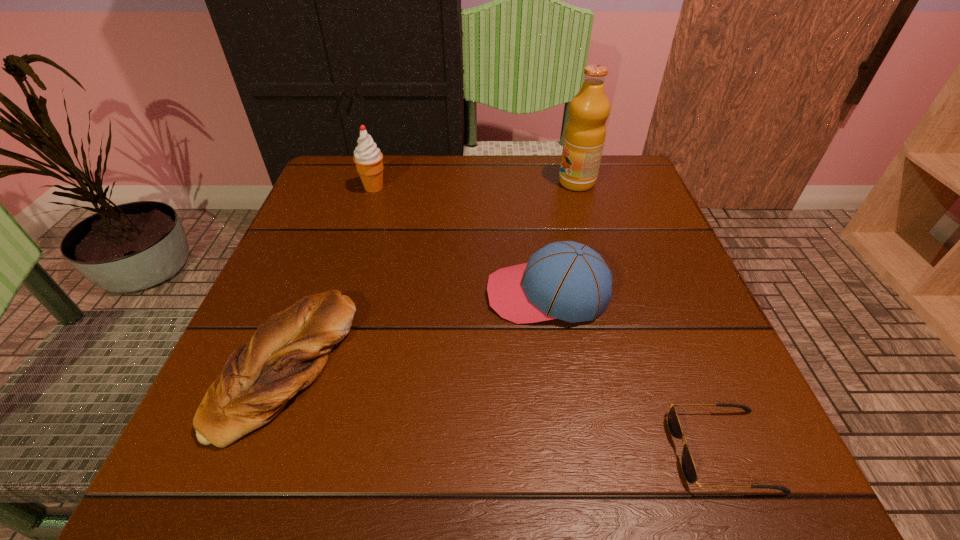
This screenshot has height=540, width=960. In the image, there is a desktop. Identify the location of vacant space at the near edge. (449, 469).

Identify the location of vacant point at the left edge. The image size is (960, 540). (332, 240).

Locate an element on the screen. This screenshot has height=540, width=960. free space at the right edge of the desktop is located at coordinates (631, 274).

The image size is (960, 540). In the image, there is a desktop. In order to click on free space at the far left corner in this screenshot , I will do `click(334, 167)`.

Identify the location of vacant area at the far right corner of the desktop. (638, 207).

You are a GUI agent. You are given a task and a screenshot of the screen. Output one action in this format:
    pyautogui.click(x=<x>, y=<y>)
    Task: Click on the empty space that is in between the second tallest object and the third shortest object
    
    Given the screenshot: What is the action you would take?
    pyautogui.click(x=461, y=241)

I want to click on unoccupied area between the baseball cap and the shortest object, so tap(635, 372).

In order to click on vacant point located between the sunglasses and the fruit juice in this screenshot , I will do `click(650, 316)`.

Locate an element on the screen. This screenshot has width=960, height=540. free space between the third tallest object and the bread is located at coordinates (418, 329).

This screenshot has height=540, width=960. What are the coordinates of `free space between the second tallest object and the fruit juice` in the screenshot? It's located at (475, 185).